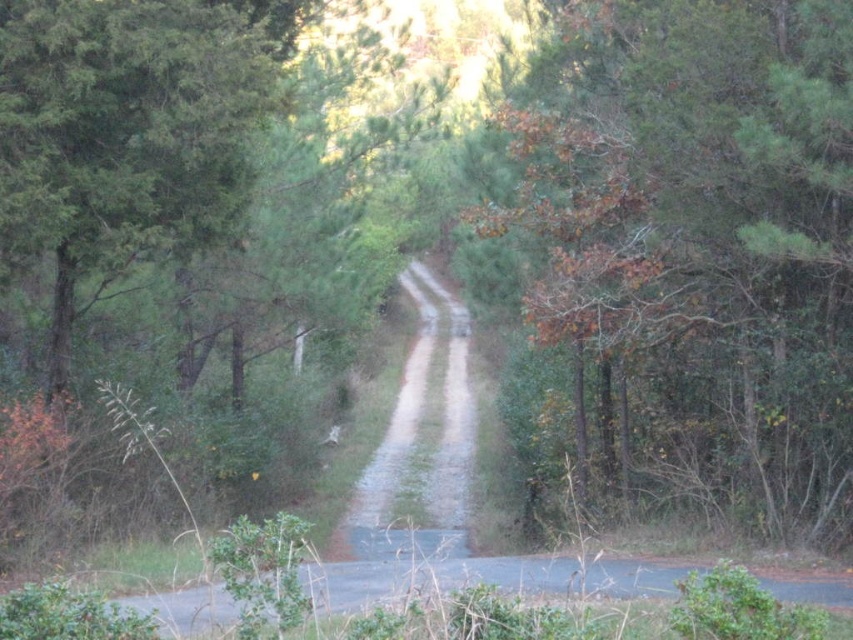
Looking at this image, you are a hiker standing at the start of the road in the forest. You notice a point marked at coordinates (x=697, y=244). What is the feature located at that point?

The point at coordinates (x=697, y=244) corresponds to brown dry leaves at upper center.